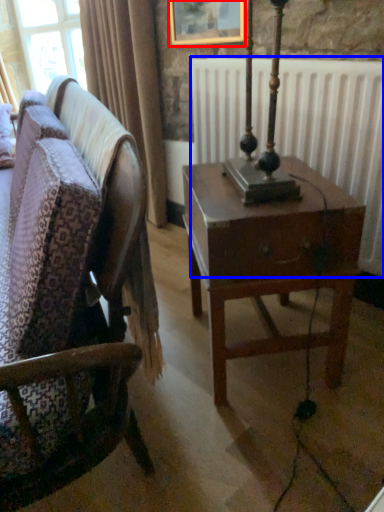
Question: Which object is closer to the camera taking this photo, picture frame (highlighted by a red box) or radiator (highlighted by a blue box)?

Choices:
 (A) picture frame
 (B) radiator

Answer: (B)